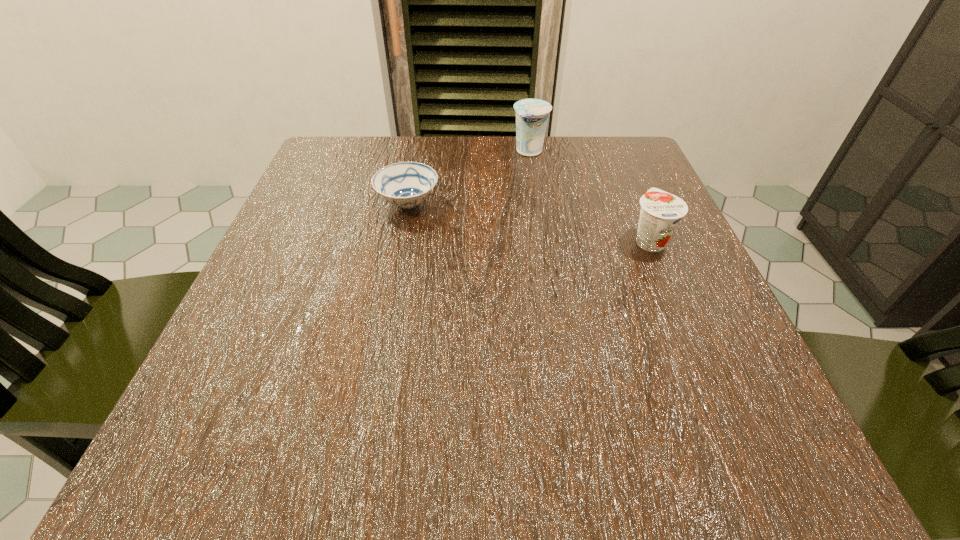
At what (x,y) coordinates should I click in order to perform the action: click on the second object from left to right. Please return your answer as a coordinate pair (x, y). This screenshot has width=960, height=540. Looking at the image, I should click on click(x=532, y=115).

This screenshot has width=960, height=540. I want to click on the taller yogurt, so click(532, 115).

Identify the location of the nearest object. The image size is (960, 540). (660, 213).

The height and width of the screenshot is (540, 960). I want to click on the rightmost object, so click(660, 213).

Image resolution: width=960 pixels, height=540 pixels. In order to click on the second farthest object in this screenshot , I will do `click(406, 184)`.

Find the location of a particular element. The image size is (960, 540). the leftmost object is located at coordinates (406, 184).

Where is `vacant position located on the front of the tallest object`? This screenshot has width=960, height=540. vacant position located on the front of the tallest object is located at coordinates (542, 237).

Image resolution: width=960 pixels, height=540 pixels. Find the location of `vacant space located 0.250m on the front of the right yogurt`. vacant space located 0.250m on the front of the right yogurt is located at coordinates (710, 386).

This screenshot has width=960, height=540. Find the location of `vacant space located 0.320m on the front of the second nearest object`. vacant space located 0.320m on the front of the second nearest object is located at coordinates (375, 369).

Find the location of a particular element. yogurt that is positioned at the far edge is located at coordinates (532, 115).